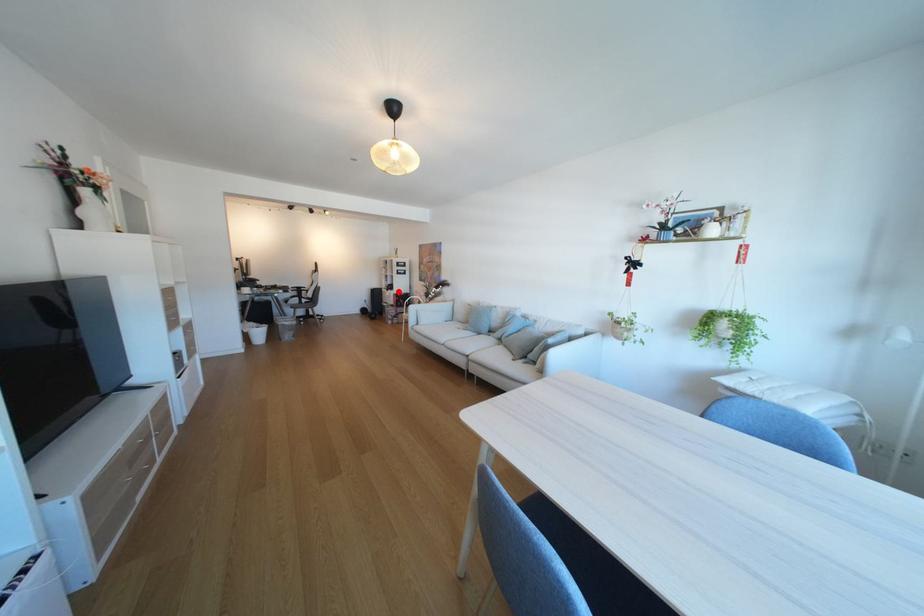
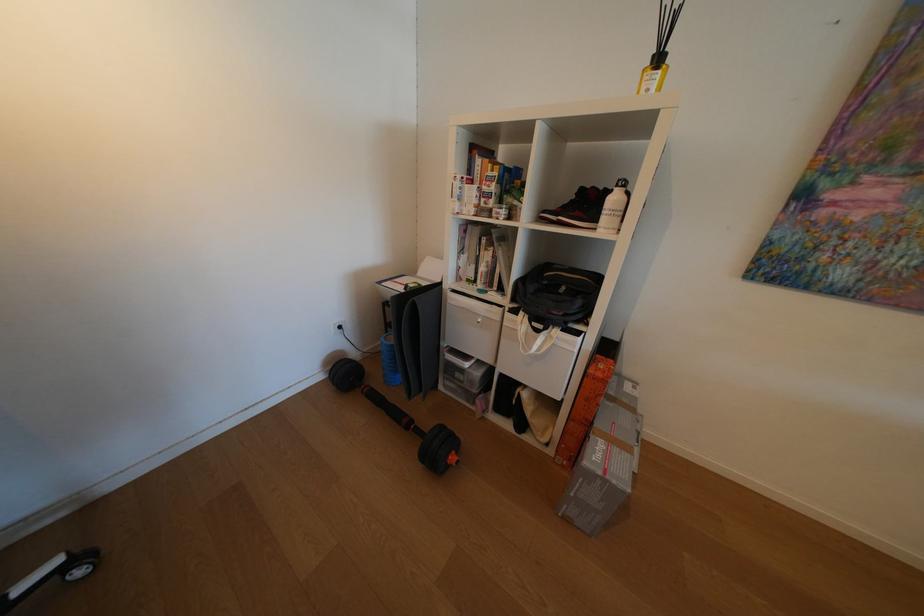
Question: I am providing you with two images of the same scene from different viewpoints. Image1 has a red point marked. In image2, the corresponding 3D location appears at what relative position? Reply with the corresponding letter.

Choices:
 (A) Closer
 (B) Farther

Answer: (B)